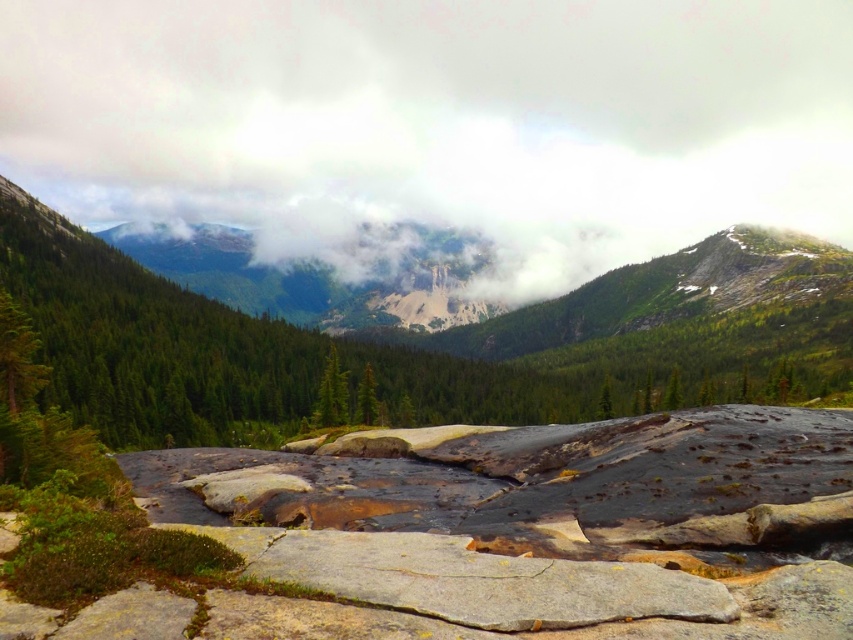
Where is `white fluffy cloud at upper center`? white fluffy cloud at upper center is located at coordinates (437, 122).

Is point (194, 12) in front of point (621, 353)?

That is False.

This screenshot has width=853, height=640. In order to click on white fluffy cloud at upper center in this screenshot , I will do `click(437, 122)`.